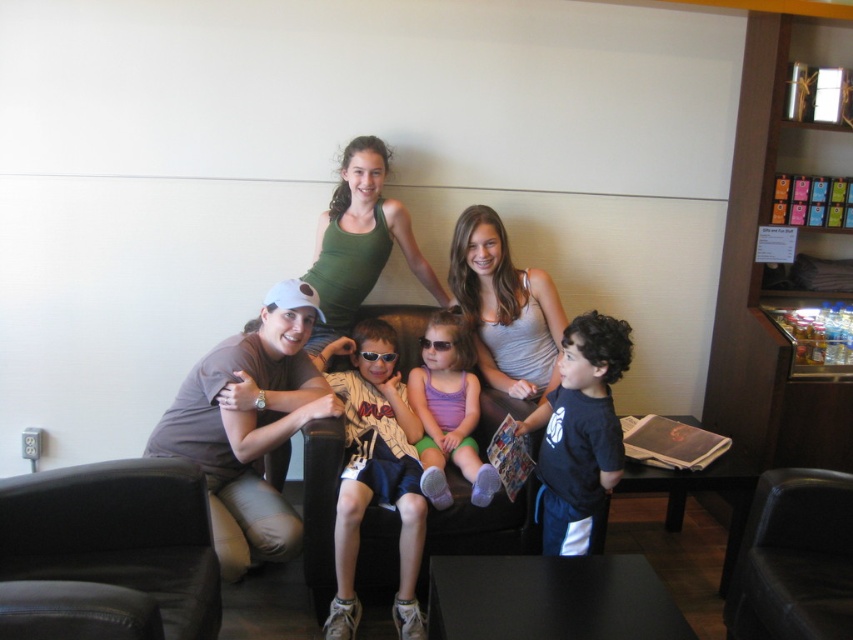
Question: Is the position of black leather armchair at lower left more distant than that of dark blue t-shirt at center?

Choices:
 (A) no
 (B) yes

Answer: (A)

Question: From the image, what is the correct spatial relationship of purple fabric dress at center in relation to sunglasses at center?

Choices:
 (A) below
 (B) above

Answer: (A)

Question: Is brown leather couch at center behind sunglasses at center?

Choices:
 (A) yes
 (B) no

Answer: (B)

Question: Based on their relative distances, which object is nearer to the sunglasses at center?

Choices:
 (A) dark blue t-shirt at center
 (B) brown leather couch at center

Answer: (B)

Question: Which point is closer to the camera taking this photo?

Choices:
 (A) (486, 253)
 (B) (235, 396)
 (C) (363, 355)

Answer: (B)

Question: Which point is closer to the camera?

Choices:
 (A) brown leather couch at center
 (B) purple fabric dress at center
 (C) white cotton shirt at center

Answer: (C)